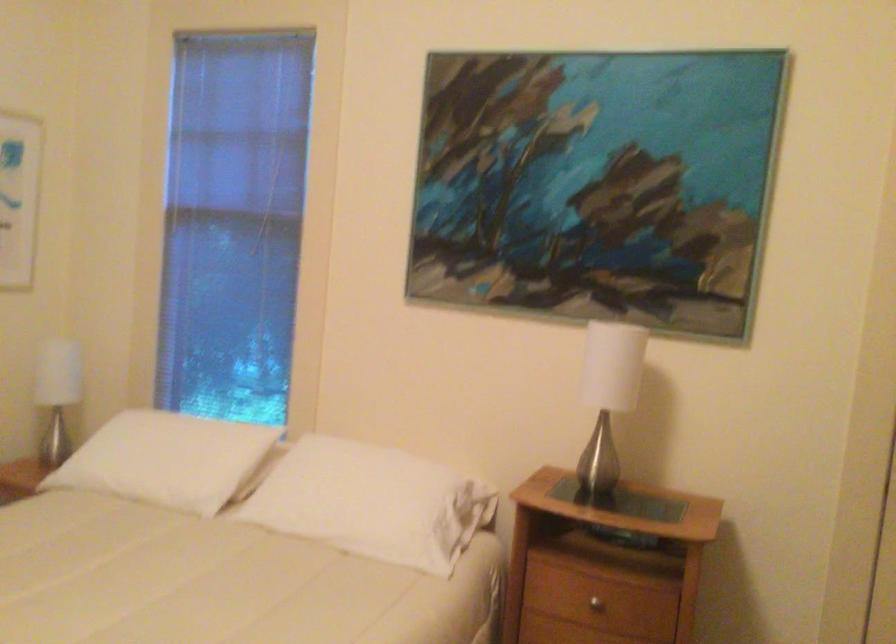
Locate an element on the screen. This screenshot has width=896, height=644. window blind cord is located at coordinates coord(277,193).